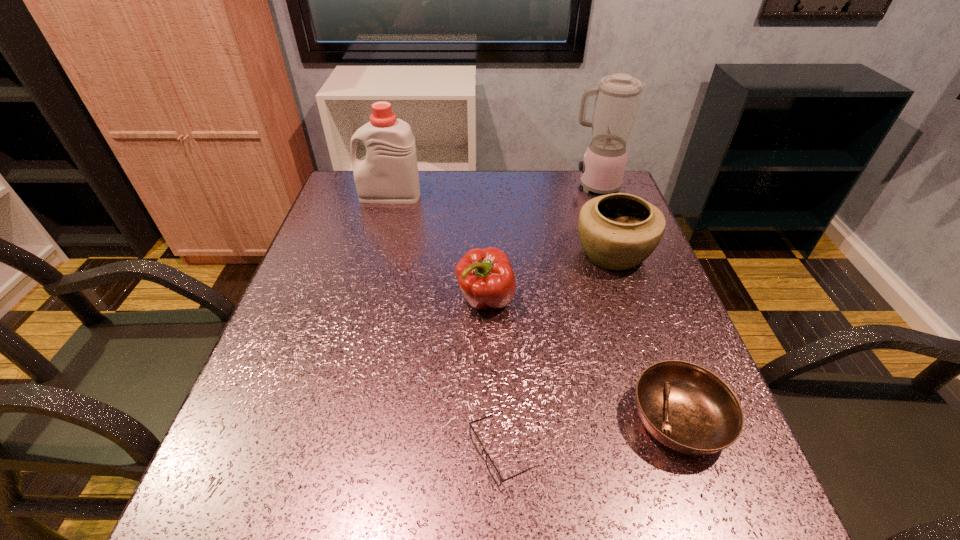
Identify the location of food processor. (617, 100).

The width and height of the screenshot is (960, 540). Identify the location of the leftmost object. (388, 174).

Identify the location of the second tallest object. This screenshot has height=540, width=960. (388, 174).

Find the location of a particular element. This screenshot has width=960, height=540. pottery is located at coordinates (618, 231).

The image size is (960, 540). I want to click on pepper, so click(485, 276).

The image size is (960, 540). I want to click on the second shortest object, so click(686, 407).

Locate an element on the screen. spectacles is located at coordinates (491, 467).

Identify the location of free region located on the base of the food processor near the control knob. This screenshot has height=540, width=960. (454, 186).

At what (x,y) coordinates should I click in order to perform the action: click on vacant area situated 0.280m on the base of the food processor near the control knob. Please return your answer as a coordinate pair (x, y). The image size is (960, 540). Looking at the image, I should click on (474, 186).

This screenshot has width=960, height=540. What are the coordinates of `vacant region located 0.290m on the base of the food processor near the control knob` in the screenshot? It's located at (470, 186).